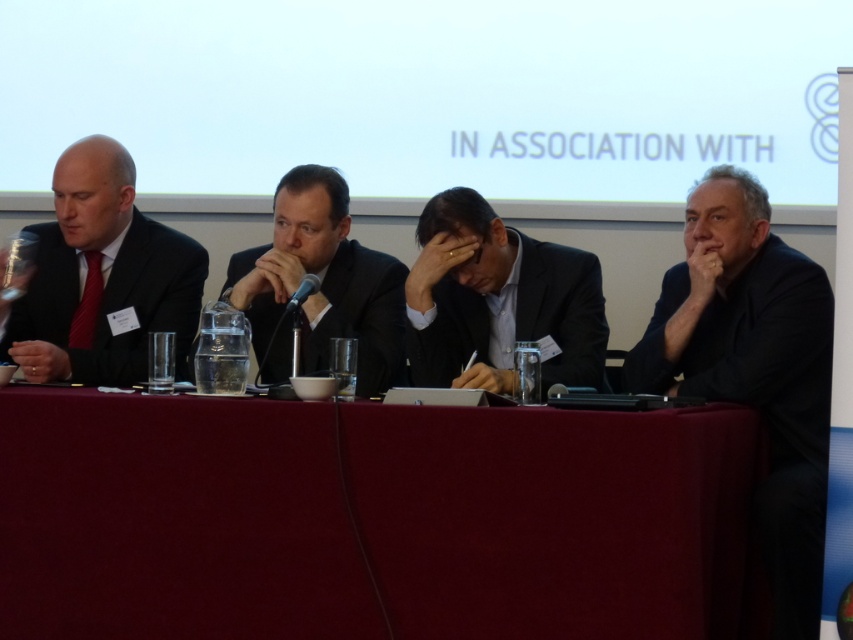
Question: Is matte black suit at left closer to camera compared to black suit at center?

Choices:
 (A) yes
 (B) no

Answer: (B)

Question: Which point is farther to the camera?

Choices:
 (A) black matte suit at right
 (B) maroon fabric table at center
 (C) black plastic microphone at center

Answer: (C)

Question: Which point is farther to the camera?

Choices:
 (A) matte black suit at left
 (B) black suit at center
 (C) dark gray suit at center

Answer: (A)

Question: Which object appears farthest from the camera in this image?

Choices:
 (A) black plastic microphone at center
 (B) dark gray suit at center
 (C) matte black suit at left
 (D) black suit at center

Answer: (C)

Question: Can you confirm if maroon fabric table at center is wider than black matte suit at right?

Choices:
 (A) yes
 (B) no

Answer: (A)

Question: From the image, what is the correct spatial relationship of maroon fabric table at center in relation to dark gray suit at center?

Choices:
 (A) left
 (B) right

Answer: (A)